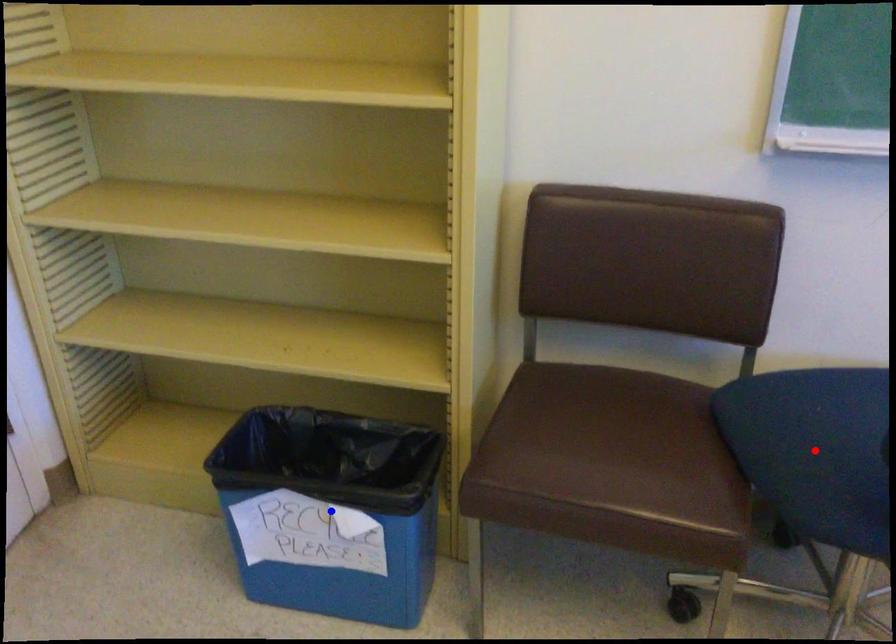
Question: Two points are marked on the image. Which point is closer to the camera?

Choices:
 (A) Blue point is closer.
 (B) Red point is closer.

Answer: (B)